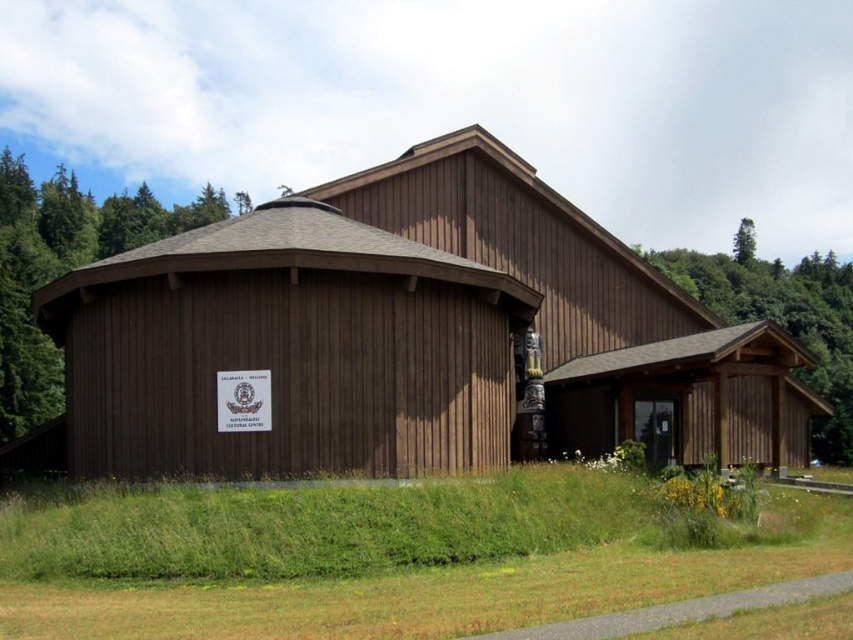
You are standing in front of the wooden building and want to determine which tree is wider. Can you identify which one is wider between the green wood tree at left and the green leafy tree at upper right?

The green wood tree at left is wider than the green leafy tree at upper right according to the description.

You are standing in front of the brown wooden barn at center and want to take a photo of the green leafy tree at upper right. Which direction should you face to capture the tree in your shot?

The brown wooden barn at center is located below the green leafy tree at upper right, so you should face upward to capture the tree in your shot.